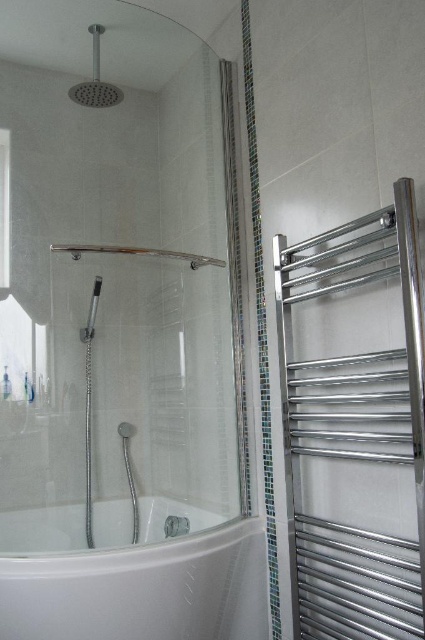
Consider the image. You are a contractor measuring distances in a bathroom. You need to install a new shelf between the polished chrome towel rack at right and the satin nickel showerhead at upper left. Which object should the shelf be closer to if it must be placed at the midpoint between them?

The polished chrome towel rack at right is closer to the viewer than the satin nickel showerhead at upper left, so the midpoint between them would place the shelf closer to the satin nickel showerhead at upper left.

You are a bathroom designer planning to place a new decorative plant stand between the polished chrome towel rack at right and the white glossy bathtub at lower left. Based on their positions, which object should the plant stand be closer to?

The polished chrome towel rack at right is in front of the white glossy bathtub at lower left, so the plant stand should be placed closer to the white glossy bathtub at lower left to maintain proper spatial alignment.